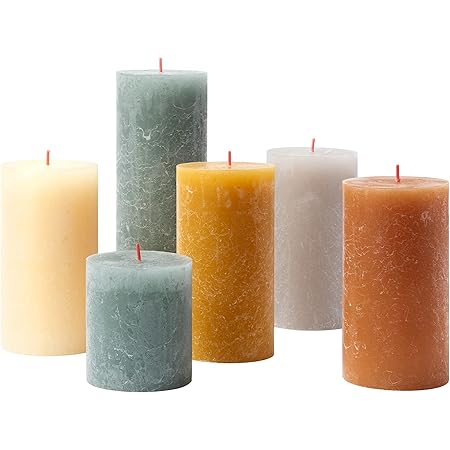
At what (x,y) coordinates should I click in order to perform the action: click on candle wicks. Please return your answer as a coordinate pair (x, y). Looking at the image, I should click on (47, 155), (161, 62), (138, 247), (229, 153), (313, 140), (396, 168).